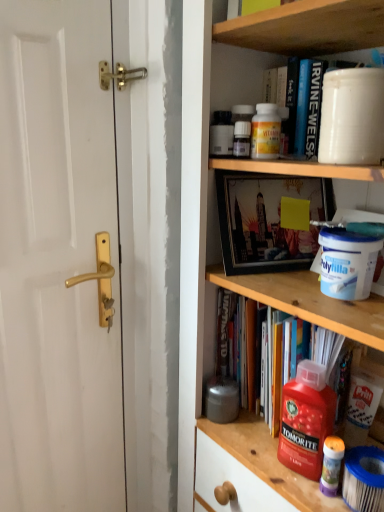
Question: Is there a large distance between red plastic bottle at lower center, the second cleaning product viewed from the top, and white glossy door handle at left?

Choices:
 (A) yes
 (B) no

Answer: (B)

Question: Does red plastic bottle at lower center, the second cleaning product viewed from the top, lie behind white glossy door handle at left?

Choices:
 (A) no
 (B) yes

Answer: (B)

Question: Does red plastic bottle at lower center, marked as the 1th cleaning product in a bottom-to-top arrangement, have a lesser width compared to white glossy door handle at left?

Choices:
 (A) no
 (B) yes

Answer: (B)

Question: From a real-world perspective, is red plastic bottle at lower center, marked as the 1th cleaning product in a bottom-to-top arrangement, physically above white glossy door handle at left?

Choices:
 (A) yes
 (B) no

Answer: (B)

Question: Would you say white glossy door handle at left is part of red plastic bottle at lower center, the second cleaning product viewed from the top,'s contents?

Choices:
 (A) no
 (B) yes

Answer: (A)

Question: From the image's perspective, is red plastic bottle at lower center, the second cleaning product viewed from the top, beneath white glossy door handle at left?

Choices:
 (A) no
 (B) yes

Answer: (B)

Question: From a real-world perspective, is white plastic container at upper center, the second cabinet in the top-to-bottom sequence, located higher than matte black bottle at upper center?

Choices:
 (A) no
 (B) yes

Answer: (B)

Question: Is white plastic container at upper center, the first cabinet in the bottom-to-top sequence, further to camera compared to matte black bottle at upper center?

Choices:
 (A) yes
 (B) no

Answer: (B)

Question: Can you confirm if white plastic container at upper center, the second cabinet in the top-to-bottom sequence, is positioned to the right of matte black bottle at upper center?

Choices:
 (A) no
 (B) yes

Answer: (B)

Question: Is white plastic container at upper center, the second cabinet in the top-to-bottom sequence, looking in the opposite direction of matte black bottle at upper center?

Choices:
 (A) yes
 (B) no

Answer: (B)

Question: Does white plastic container at upper center, the first cabinet in the bottom-to-top sequence, have a greater width compared to matte black bottle at upper center?

Choices:
 (A) yes
 (B) no

Answer: (A)

Question: Considering the relative sizes of white plastic container at upper center, the first cabinet in the bottom-to-top sequence, and matte black bottle at upper center in the image provided, is white plastic container at upper center, the first cabinet in the bottom-to-top sequence, bigger than matte black bottle at upper center?

Choices:
 (A) no
 (B) yes

Answer: (B)

Question: Does wooden shelf at upper center, which is the first cabinet from top to bottom, have a greater width compared to white plastic container at upper center, the first cabinet in the bottom-to-top sequence?

Choices:
 (A) yes
 (B) no

Answer: (B)